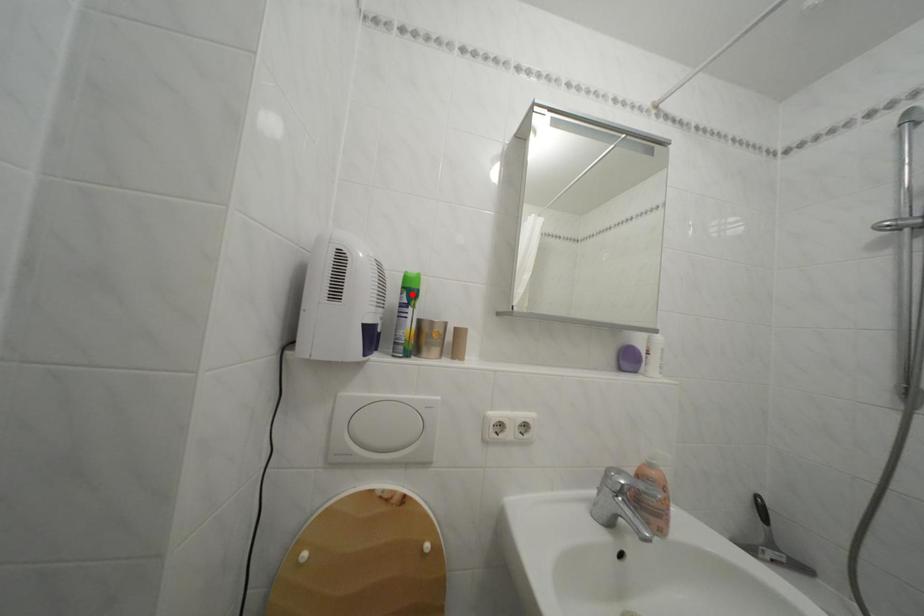
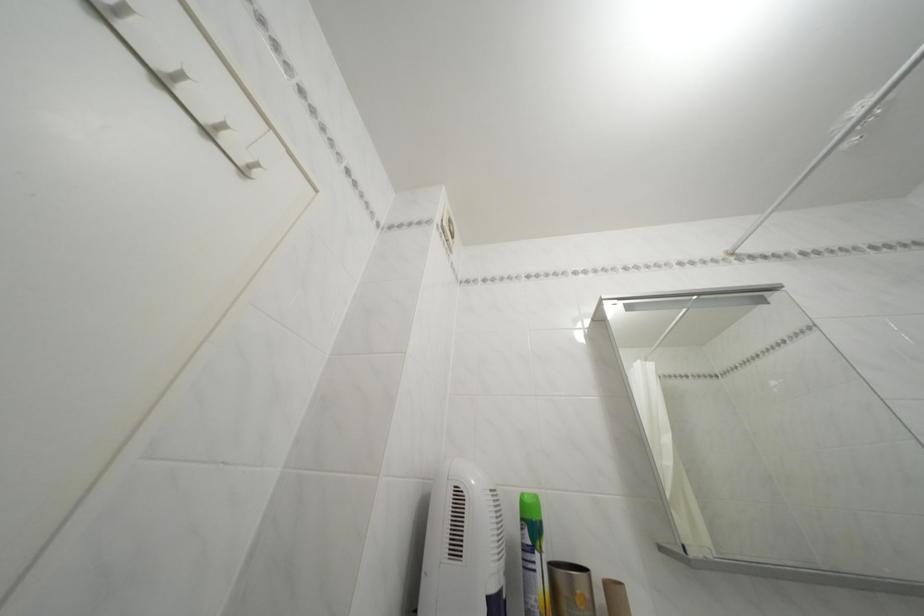
The point at the highlighted location is marked in the first image. Where is the corresponding point in the second image?

(531, 525)